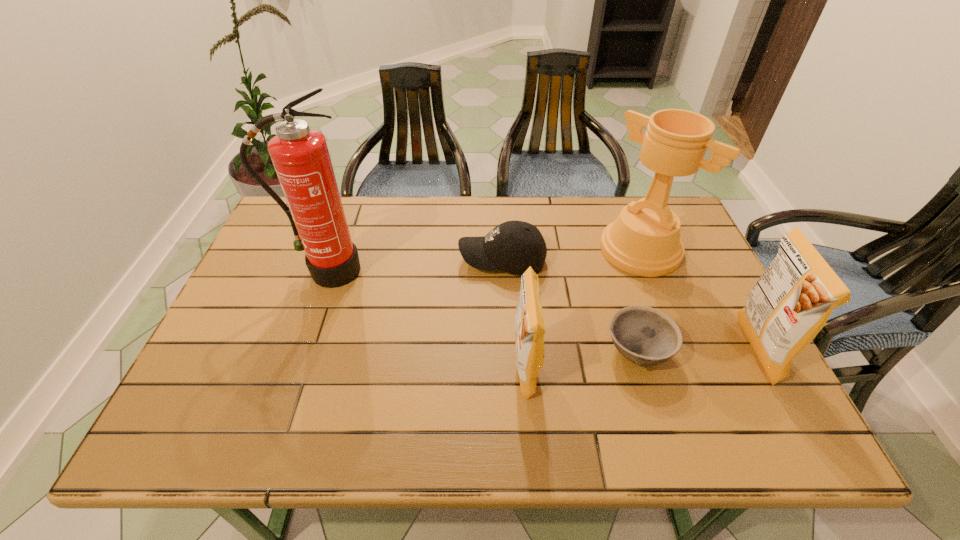
Find the location of a particular element. The image size is (960, 540). free area in between the right crisp (potato chip) and the bowl is located at coordinates (696, 351).

Locate an element on the screen. The width and height of the screenshot is (960, 540). free point between the shortest object and the shorter crisp (potato chip) is located at coordinates pos(581,360).

Locate an element on the screen. The height and width of the screenshot is (540, 960). unoccupied position between the third shortest object and the fire extinguisher is located at coordinates (425, 320).

Where is `object that ranks as the fifth closest to the fifth shortest object`? Image resolution: width=960 pixels, height=540 pixels. object that ranks as the fifth closest to the fifth shortest object is located at coordinates (300, 156).

At what (x,y) coordinates should I click in order to perform the action: click on the fifth closest object to the tallest object. Please return your answer as a coordinate pair (x, y). The image size is (960, 540). Looking at the image, I should click on tap(791, 302).

You are a GUI agent. You are given a task and a screenshot of the screen. Output one action in this format:
    pyautogui.click(x=<x>, y=<y>)
    Task: Click on the vacant space that satisfies the following two spatial constraints: 1. on the front-facing side of the fifth tallest object; 2. on the back side of the bowl
    
    Given the screenshot: What is the action you would take?
    pyautogui.click(x=507, y=351)

I want to click on free space that satisfies the following two spatial constraints: 1. on the front-facing side of the baseball cap; 2. on the front-facing side of the leftmost object, so click(x=503, y=271).

Image resolution: width=960 pixels, height=540 pixels. Find the location of `vacant space that satisfies the following two spatial constraints: 1. on the front-facing side of the bowl; 2. on the right side of the tallest object`. vacant space that satisfies the following two spatial constraints: 1. on the front-facing side of the bowl; 2. on the right side of the tallest object is located at coordinates (300, 351).

Find the location of a particular element. The width and height of the screenshot is (960, 540). vacant space that satisfies the following two spatial constraints: 1. on the front-facing side of the fifth tallest object; 2. on the left side of the bowl is located at coordinates (507, 351).

The image size is (960, 540). I want to click on vacant region that satisfies the following two spatial constraints: 1. on the front-facing side of the second shortest object; 2. on the back side of the shortest object, so click(x=507, y=351).